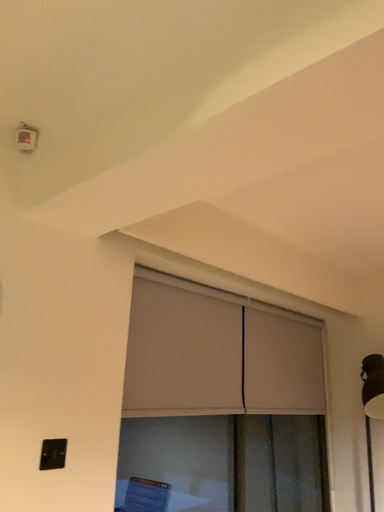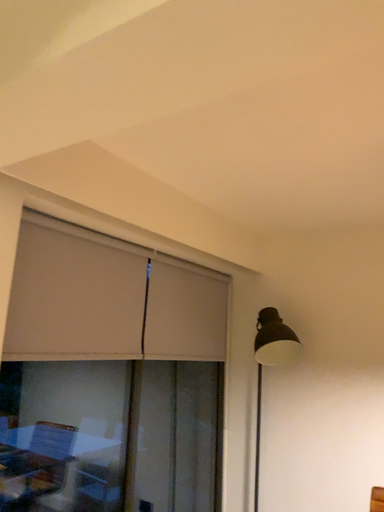
Question: Which way did the camera rotate in the video?

Choices:
 (A) rotated upward
 (B) rotated downward

Answer: (B)